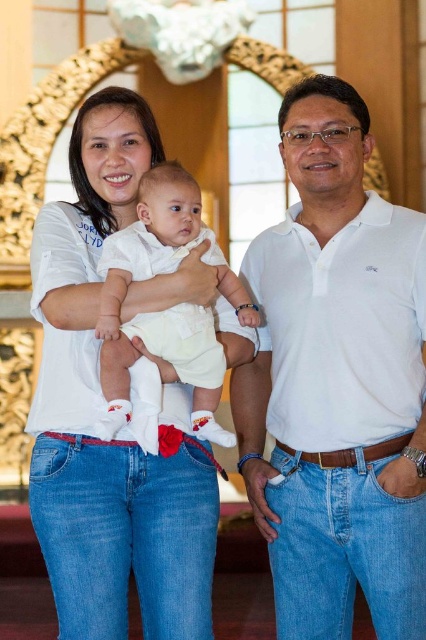
You are standing at the point closest to the camera in this family portrait. Which point are you at, point [287,442] or point [221,284]?

You are at point [221,284] because it is closer to the camera than point [287,442], which is behind it.

You are a photographer trying to decide whether to adjust the camera frame to include both the white cotton polo shirt at center and the white cotton baby at center. Based on their sizes, which one takes up more space in the image?

The white cotton polo shirt at center takes up more space in the image because its width is larger than the white cotton baby at center.